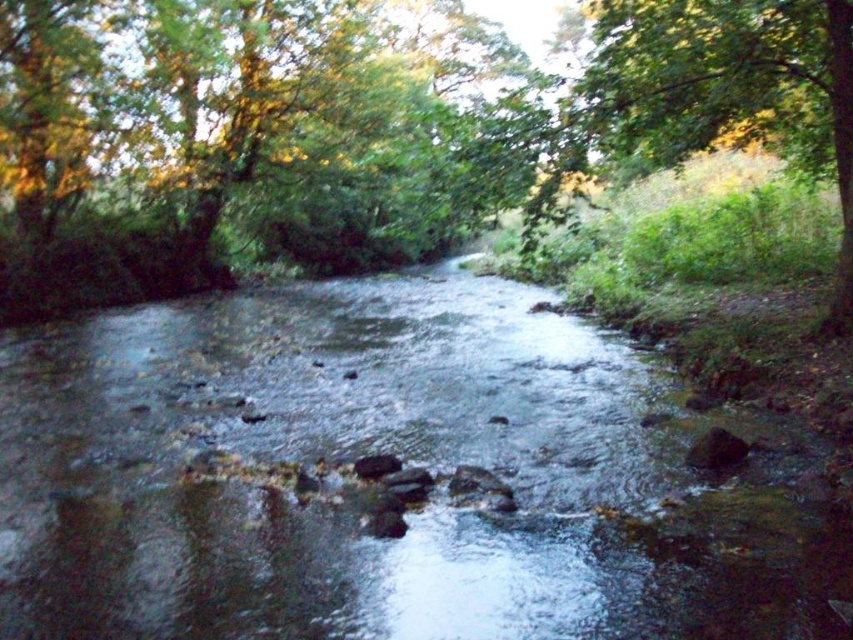
Is clear water at center smaller than green leafy tree at center?

Indeed, clear water at center has a smaller size compared to green leafy tree at center.

What do you see at coordinates (357, 454) in the screenshot? This screenshot has width=853, height=640. I see `clear water at center` at bounding box center [357, 454].

Who is more distant from viewer, (123,388) or (64,276)?

Point (64,276)

Identify the location of clear water at center. (357, 454).